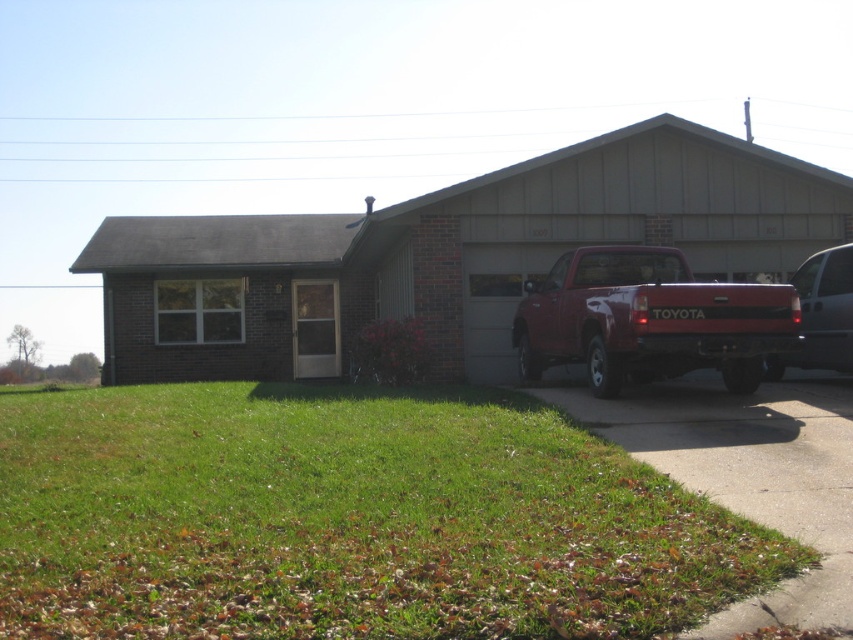
Is green grass at lower left taller than gray concrete driveway at lower right?

Indeed, green grass at lower left has a greater height compared to gray concrete driveway at lower right.

Who is higher up, green grass at lower left or gray concrete driveway at lower right?

gray concrete driveway at lower right is higher up.

Between point (15, 589) and point (669, 464), which one is positioned in front?

Point (15, 589) is more forward.

You are a GUI agent. You are given a task and a screenshot of the screen. Output one action in this format:
    pyautogui.click(x=<x>, y=<y>)
    Task: Click on the green grass at lower left
    This screenshot has width=853, height=640.
    Given the screenshot: What is the action you would take?
    pyautogui.click(x=349, y=518)

Does green grass at lower left appear on the left side of matte red truck at right?

Indeed, green grass at lower left is positioned on the left side of matte red truck at right.

Does point (178, 627) come behind point (613, 358)?

No.

Is point (70, 564) farther from camera compared to point (595, 316)?

No.

Locate an element on the screen. The width and height of the screenshot is (853, 640). green grass at lower left is located at coordinates (349, 518).

Can you confirm if gray concrete driveway at lower right is positioned above metallic silver van at right?

Actually, gray concrete driveway at lower right is below metallic silver van at right.

This screenshot has height=640, width=853. Describe the element at coordinates (749, 472) in the screenshot. I see `gray concrete driveway at lower right` at that location.

Identify the location of gray concrete driveway at lower right. This screenshot has width=853, height=640. (749, 472).